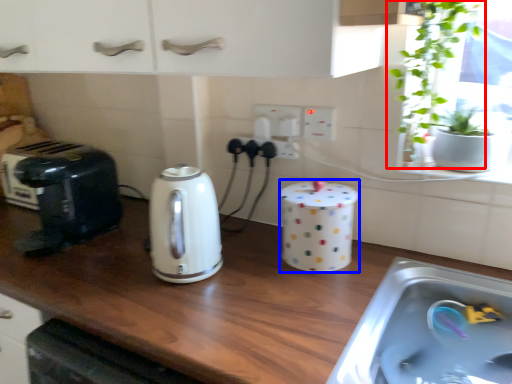
Question: Which object is closer to the camera taking this photo, houseplant (highlighted by a red box) or appliance (highlighted by a blue box)?

Choices:
 (A) houseplant
 (B) appliance

Answer: (A)